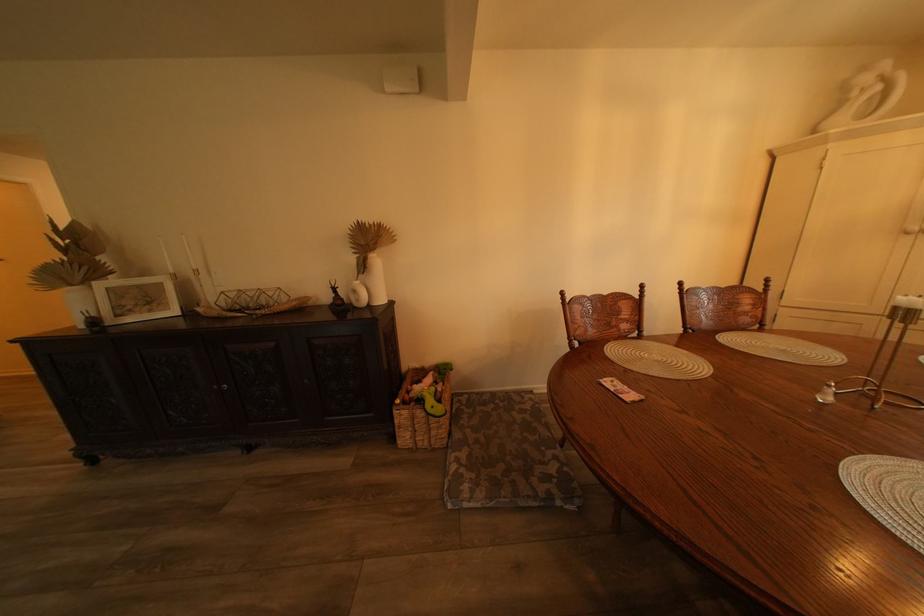
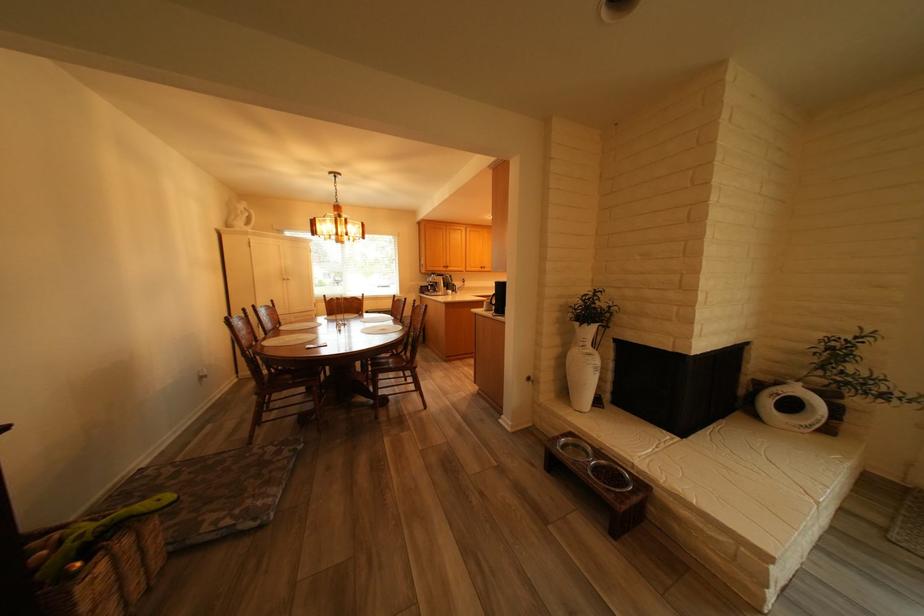
In the second image, find the point that corresponds to pixel 868 95 in the first image.

(253, 213)